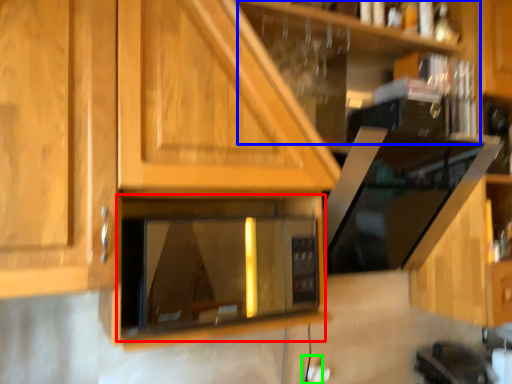
Question: Based on their relative distances, which object is nearer to appliance (highlighted by a red box)? Choose from shelf (highlighted by a blue box) and electric outlet (highlighted by a green box).

Choices:
 (A) shelf
 (B) electric outlet

Answer: (A)